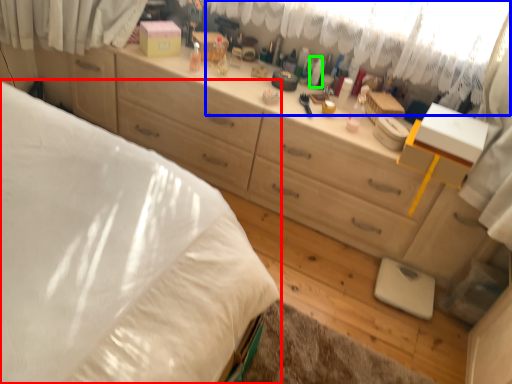
Question: Estimate the real-world distances between objects in this image. Which object is closer to bed (highlighted by a red box), curtain (highlighted by a blue box) or toiletry (highlighted by a green box)?

Choices:
 (A) curtain
 (B) toiletry

Answer: (A)